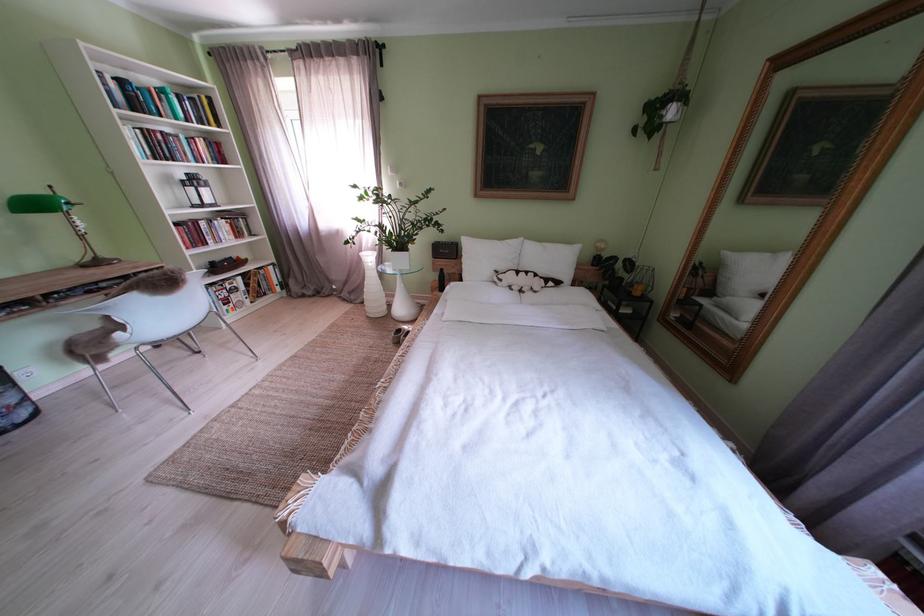
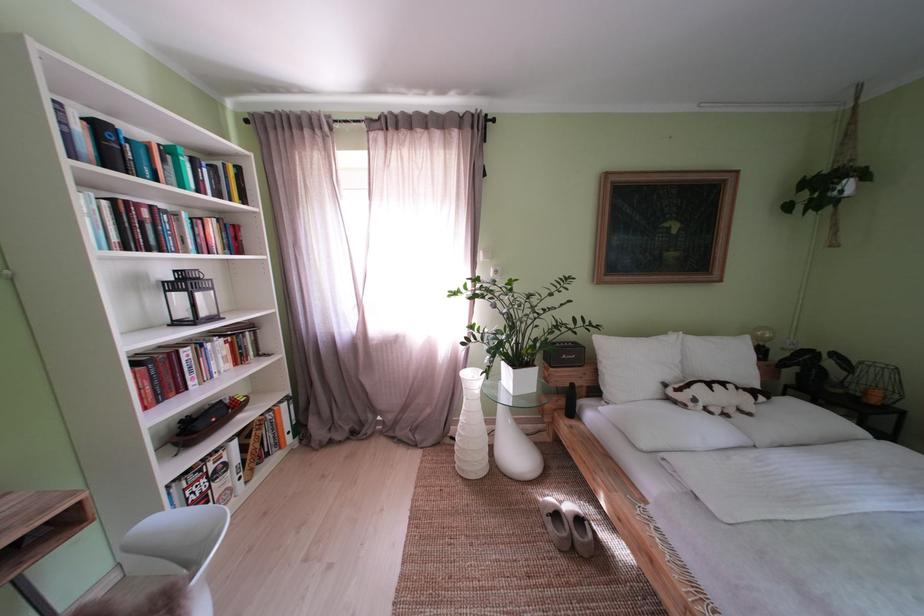
Find the pixel in the second image that matches pixel 490 262 in the first image.

(639, 369)